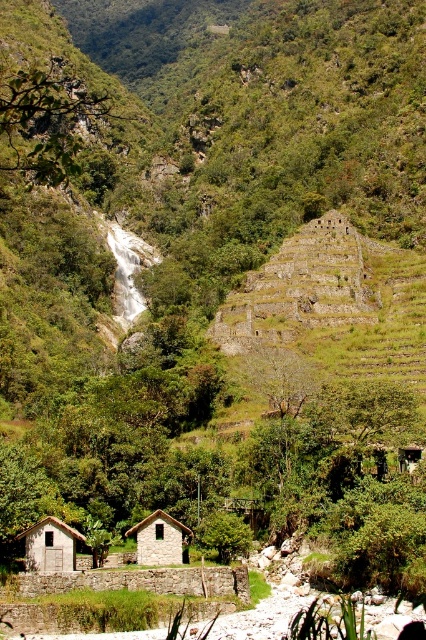
Which is more to the left, gray stone hut at lower left or stone textured hut at center?

gray stone hut at lower left is more to the left.

Between gray stone hut at lower left and stone textured hut at center, which one is positioned higher?

Positioned higher is gray stone hut at lower left.

At what (x,y) coordinates should I click in order to perform the action: click on gray stone hut at lower left. Please return your answer as a coordinate pair (x, y). The height and width of the screenshot is (640, 426). Looking at the image, I should click on (x=49, y=545).